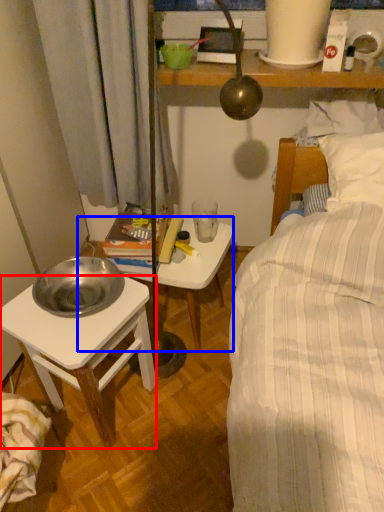
Question: Which object appears farthest to the camera in this image, desk (highlighted by a red box) or table (highlighted by a blue box)?

Choices:
 (A) desk
 (B) table

Answer: (B)